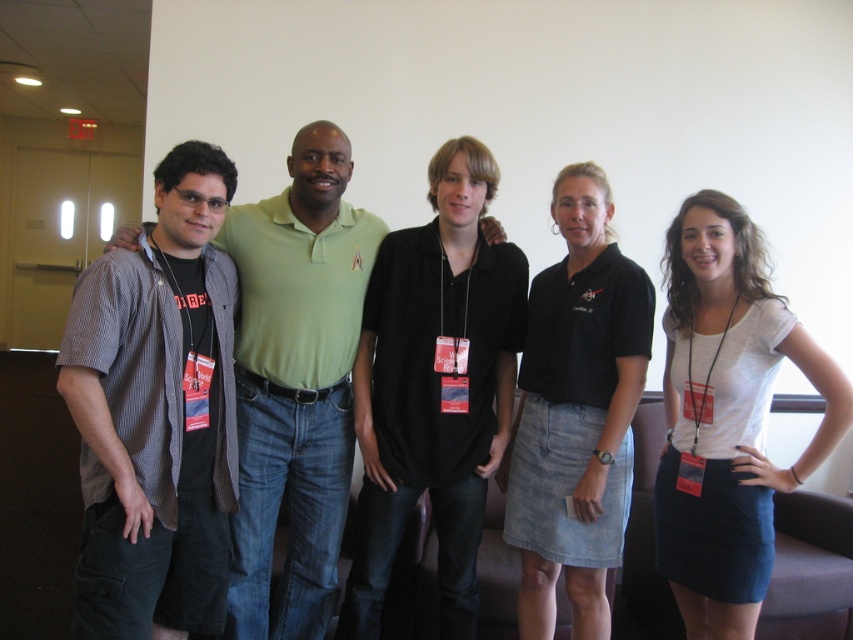
Consider the image. Which is more to the right, checkered fabric shirt at center or black denim skirt at center?

From the viewer's perspective, black denim skirt at center appears more on the right side.

Between checkered fabric shirt at center and black denim skirt at center, which one has less height?

With less height is black denim skirt at center.

Who is more forward, (x=328, y=445) or (x=575, y=477)?

Point (x=575, y=477)

Locate an element on the screen. This screenshot has width=853, height=640. checkered fabric shirt at center is located at coordinates (296, 381).

In the scene shown: Is the position of black cotton shirt at center less distant than that of black denim skirt at center?

That is False.

Is point (489, 388) farther from viewer compared to point (596, 438)?

Yes, it is.

Which is behind, point (383, 470) or point (537, 518)?

The point (537, 518) is more distant.

I want to click on black cotton shirt at center, so click(434, 387).

Between checkered fabric shirt at left and black denim skirt at center, which one appears on the right side from the viewer's perspective?

Positioned to the right is black denim skirt at center.

Does checkered fabric shirt at left appear over black denim skirt at center?

Yes.

Identify the location of checkered fabric shirt at left. (155, 413).